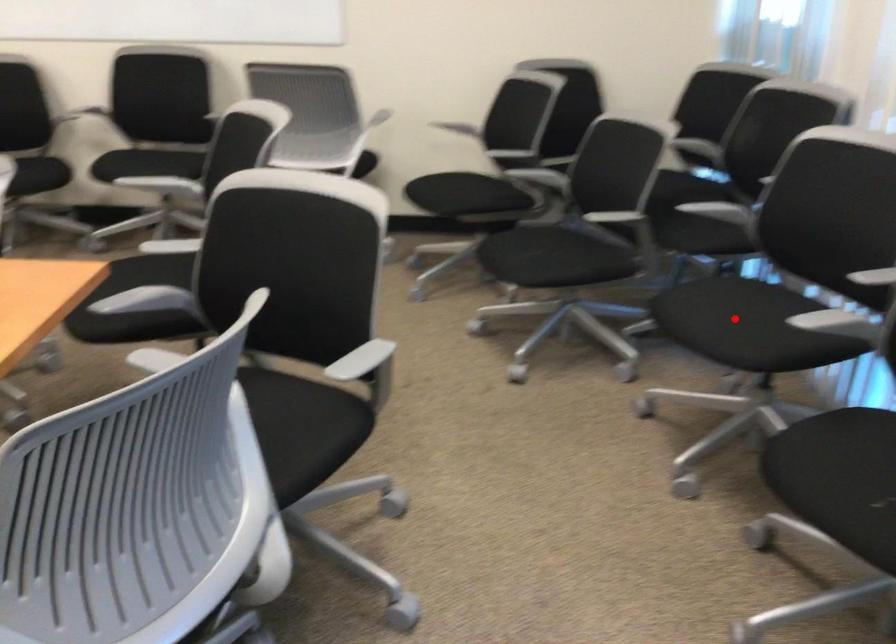
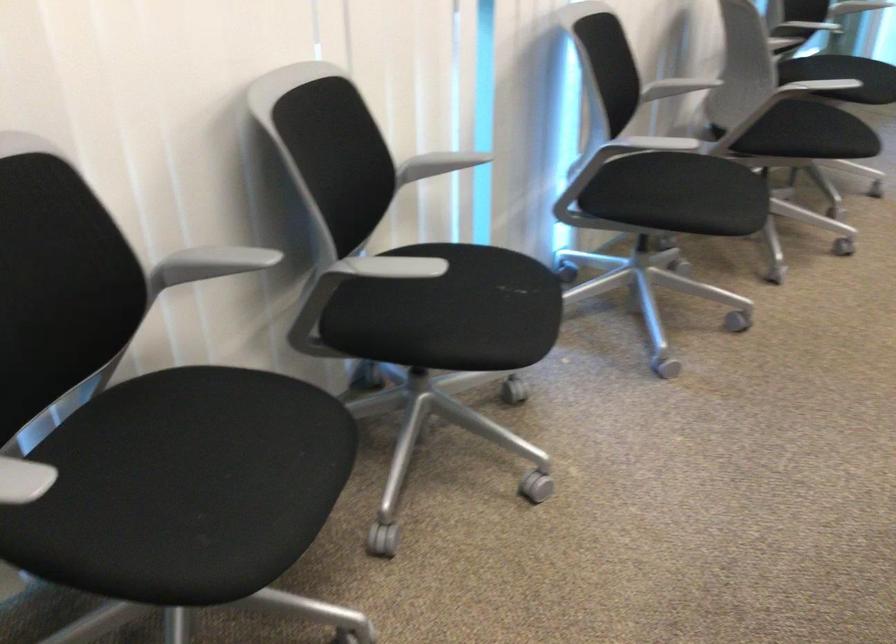
Find the pixel in the second image that matches the highlighted location in the first image.

(226, 456)